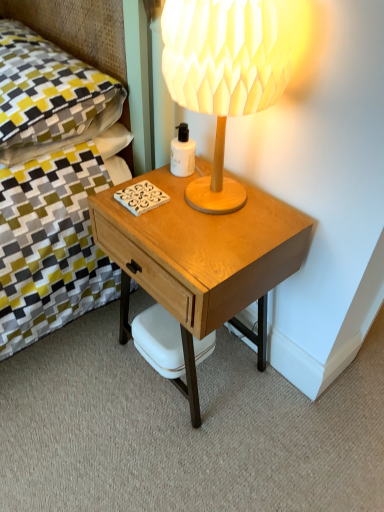
Where is `free point below wooden lampshade at upper right (from a real-world perspective)`? The width and height of the screenshot is (384, 512). free point below wooden lampshade at upper right (from a real-world perspective) is located at coordinates (220, 197).